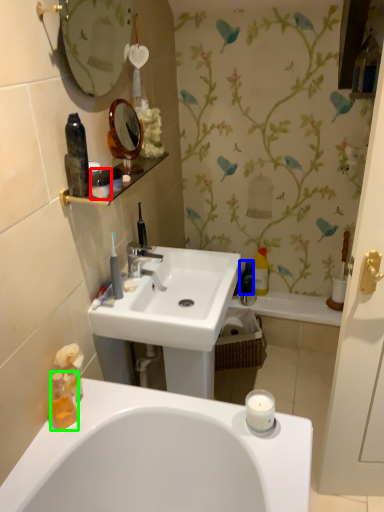
Question: Which object is positioned closest to toiletry (highlighted by a red box)? Select from bottle (highlighted by a blue box) and bottle (highlighted by a green box).

Choices:
 (A) bottle
 (B) bottle

Answer: (B)